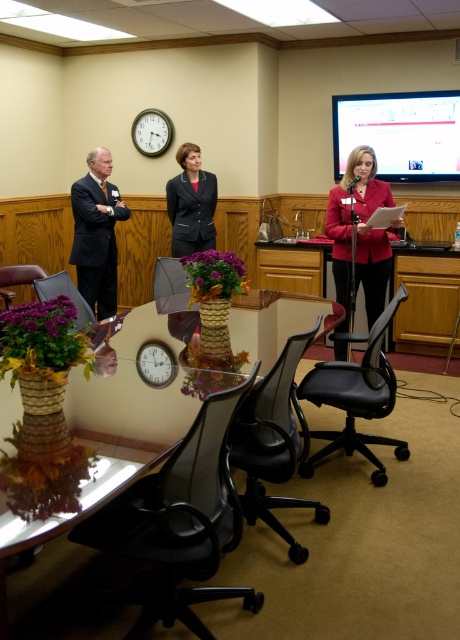
Question: Estimate the real-world distances between objects in this image. Which object is closer to the dark blue suit at left?

Choices:
 (A) black mesh office chair at center
 (B) matte black blazer at center
 (C) black mesh swivel chair at right
 (D) black plastic swivel chair at lower center

Answer: (B)

Question: Which of the following is the closest to the observer?

Choices:
 (A) (113, 252)
 (B) (355, 168)

Answer: (B)

Question: Which point appears farthest from the camera in this image?

Choices:
 (A) (333, 198)
 (B) (224, 392)
 (C) (39, 285)

Answer: (A)

Question: Does black plastic swivel chair at lower center have a greater width compared to black mesh swivel chair at right?

Choices:
 (A) no
 (B) yes

Answer: (A)

Question: Does matte red blazer at center have a larger size compared to matte black blazer at center?

Choices:
 (A) yes
 (B) no

Answer: (A)

Question: Is dark blue suit at left below black mesh office chair at center?

Choices:
 (A) no
 (B) yes

Answer: (A)